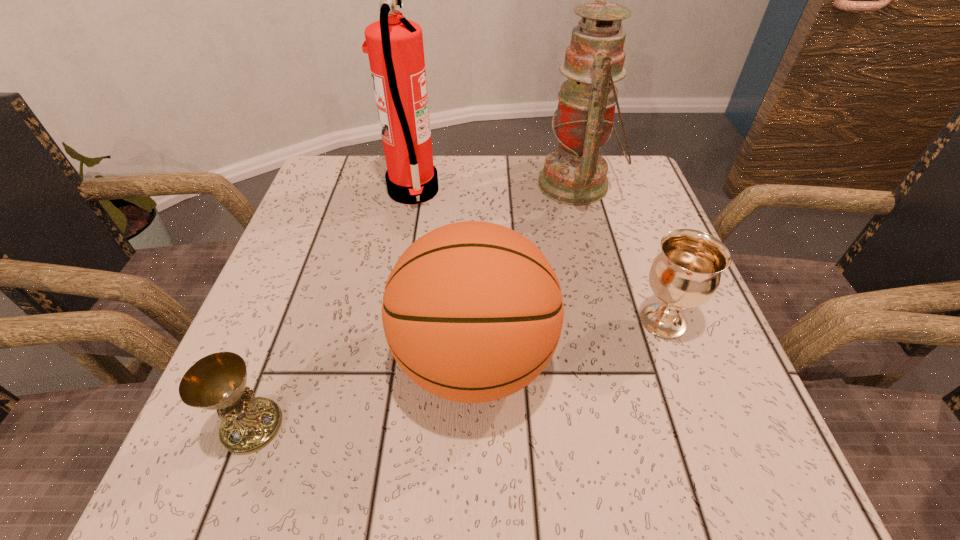
The height and width of the screenshot is (540, 960). What are the coordinates of `object that is at the far right corner` in the screenshot? It's located at (575, 174).

This screenshot has width=960, height=540. In order to click on vacant space at the far edge of the desktop in this screenshot , I will do `click(501, 177)`.

The height and width of the screenshot is (540, 960). In the image, there is a desktop. In order to click on vacant space at the near edge in this screenshot , I will do `click(322, 474)`.

The width and height of the screenshot is (960, 540). In order to click on vacant space at the left edge of the desktop in this screenshot , I will do `click(325, 352)`.

At what (x,y) coordinates should I click in order to perform the action: click on vacant space at the right edge of the desktop. Please return your answer as a coordinate pair (x, y). This screenshot has width=960, height=540. Looking at the image, I should click on (652, 352).

You are a GUI agent. You are given a task and a screenshot of the screen. Output one action in this format:
    pyautogui.click(x=<x>, y=<y>)
    Task: Click on the free spot at the far left corner of the desktop
    This screenshot has height=540, width=960.
    Given the screenshot: What is the action you would take?
    pyautogui.click(x=306, y=212)

At what (x,y) coordinates should I click in order to perform the action: click on free space at the near left corner. Please return your answer as a coordinate pair (x, y). This screenshot has width=960, height=540. Looking at the image, I should click on (252, 470).

This screenshot has height=540, width=960. Find the location of `vacant region at the far right corner`. vacant region at the far right corner is located at coordinates (608, 205).

At what (x,y) coordinates should I click in order to perform the action: click on empty location between the basketball and the fourth tallest object. Please return your answer as a coordinate pair (x, y). The image size is (960, 540). Looking at the image, I should click on (568, 341).

You are a GUI agent. You are given a task and a screenshot of the screen. Output one action in this format:
    pyautogui.click(x=<x>, y=<y>)
    Task: Click on the free space that is in between the fire extinguisher and the nearer chalice
    
    Given the screenshot: What is the action you would take?
    pyautogui.click(x=332, y=308)